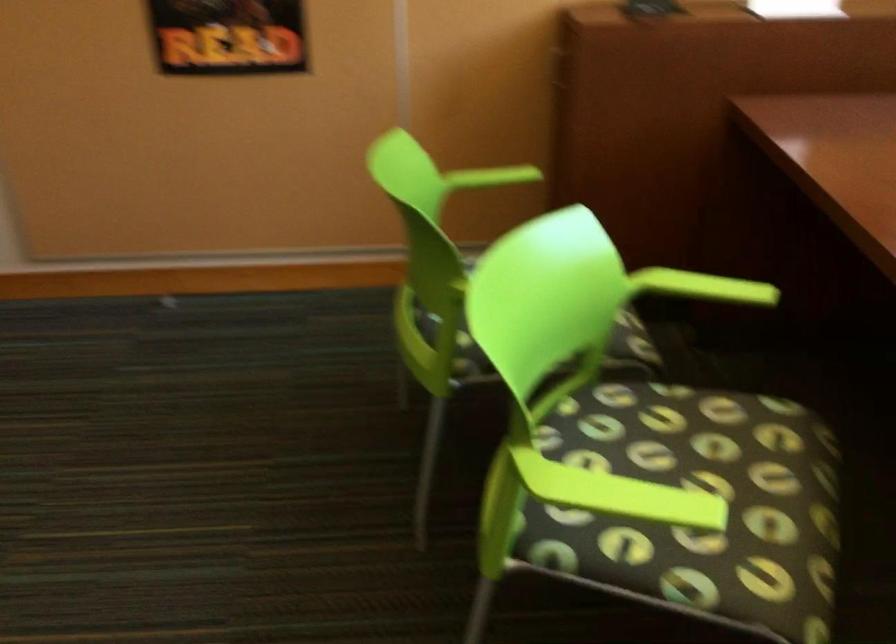
Locate an element on the screen. The width and height of the screenshot is (896, 644). chair sitting surface is located at coordinates (708, 482).